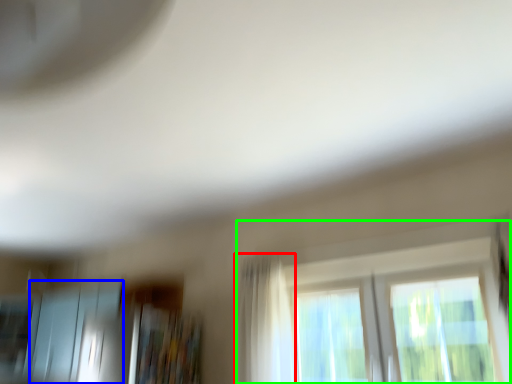
Question: Estimate the real-world distances between objects in this image. Which object is farther from curtain (highlighted by a red box), screen door (highlighted by a blue box) or window (highlighted by a green box)?

Choices:
 (A) screen door
 (B) window

Answer: (A)